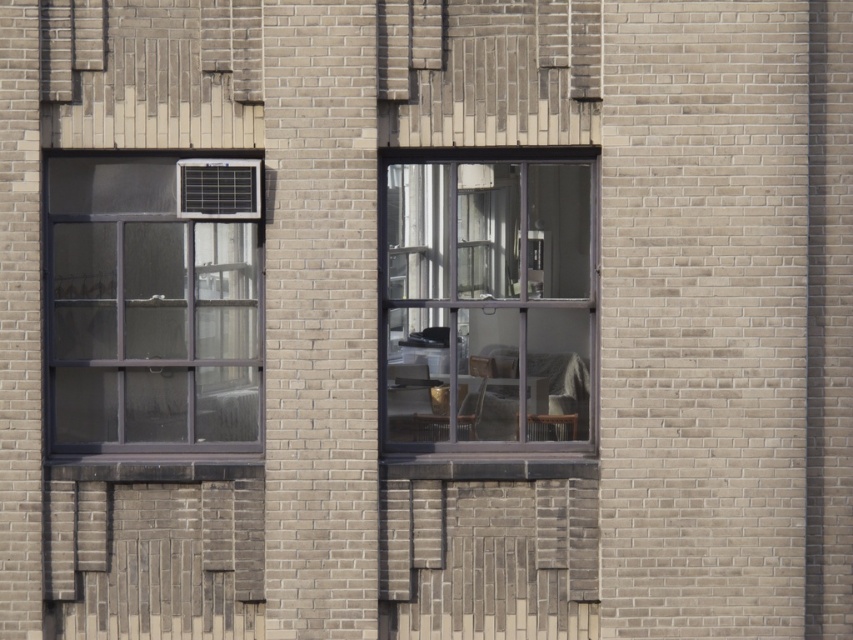
Is clear glass window at left further to camera compared to clear glass window at center?

No, clear glass window at left is in front of clear glass window at center.

Is clear glass window at left thinner than clear glass window at center?

No, clear glass window at left is not thinner than clear glass window at center.

Who is more forward, [50,273] or [589,440]?

Point [50,273]

You are a GUI agent. You are given a task and a screenshot of the screen. Output one action in this format:
    pyautogui.click(x=<x>, y=<y>)
    Task: Click on the clear glass window at left
    
    Given the screenshot: What is the action you would take?
    pyautogui.click(x=154, y=304)